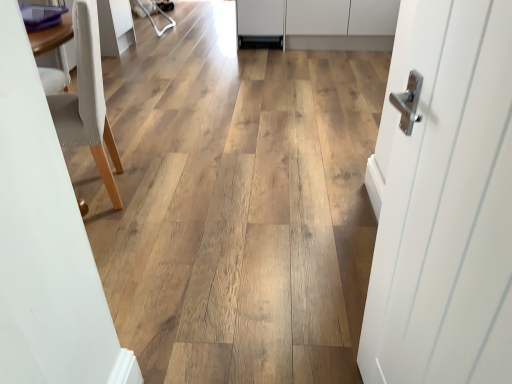
Question: Is point (92, 1) closer or farther from the camera than point (498, 311)?

Choices:
 (A) closer
 (B) farther

Answer: (B)

Question: Considering the positions of light beige fabric chair at left and white smooth door at right in the image, is light beige fabric chair at left taller or shorter than white smooth door at right?

Choices:
 (A) tall
 (B) short

Answer: (B)

Question: Considering the real-world distances, which object is closest to the white matte cabinet at upper center?

Choices:
 (A) light beige fabric chair at left
 (B) white smooth door at right

Answer: (A)

Question: Which object is the closest to the light beige fabric chair at left?

Choices:
 (A) white smooth door at right
 (B) white matte cabinet at upper center

Answer: (A)